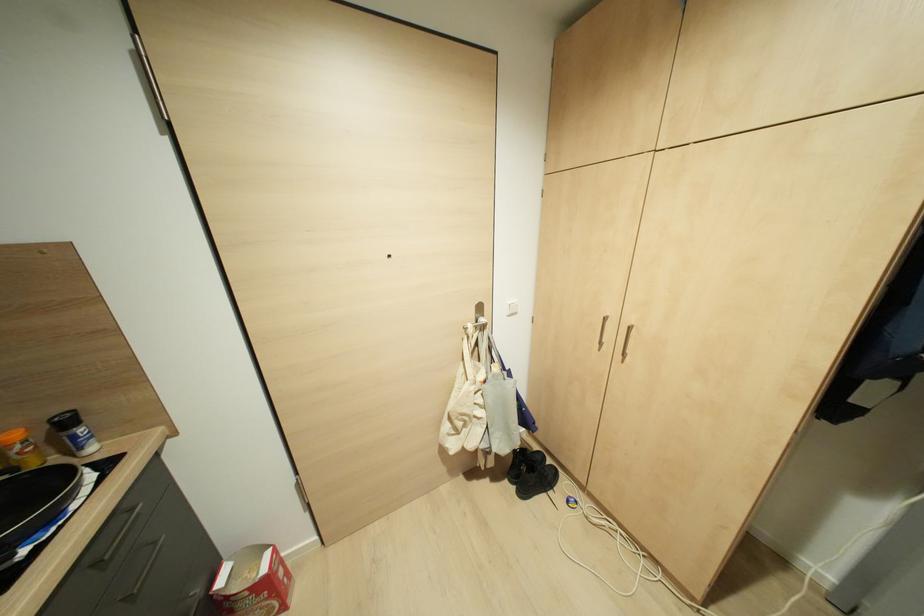
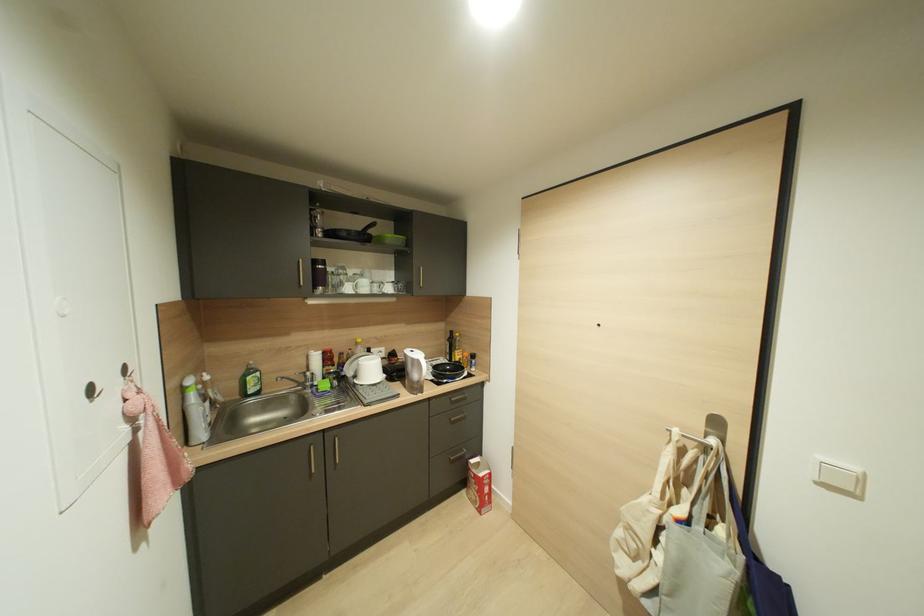
Question: Based on the continuous images, in which direction is the camera rotating? Reply with the corresponding letter.

Choices:
 (A) Left
 (B) Right
 (C) Up
 (D) Down

Answer: (A)